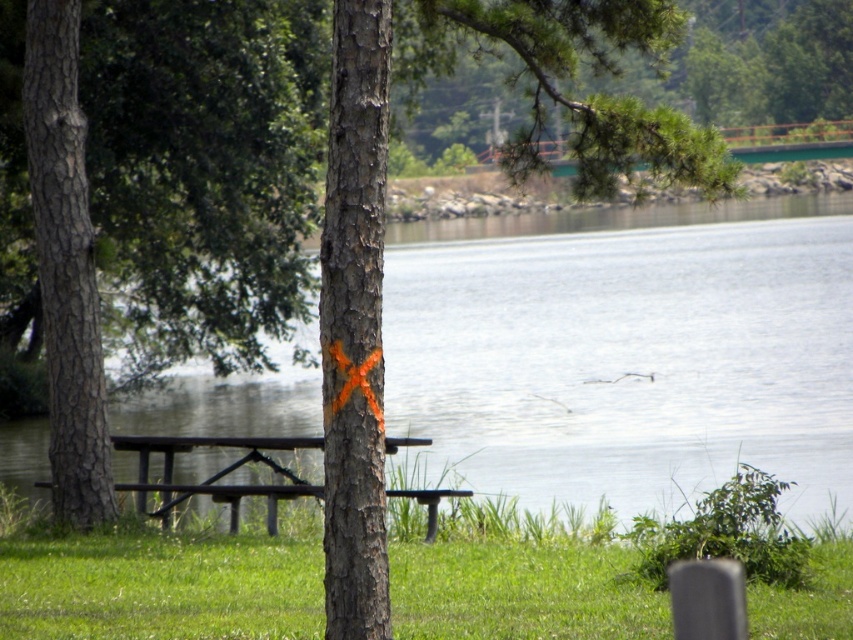
Who is positioned more to the right, transparent water at center or brown wooden picnic table at center?

transparent water at center is more to the right.

Who is more distant from viewer, (434, 259) or (259, 445)?

Positioned behind is point (434, 259).

Identify the location of transparent water at center. The image size is (853, 640). (628, 348).

Which is in front, point (457, 416) or point (181, 180)?

Positioned in front is point (181, 180).

Is point (170, 424) closer to camera compared to point (229, 179)?

No, it is behind (229, 179).

Which is behind, point (460, 220) or point (265, 273)?

The point (460, 220) is behind.

Where is `transparent water at center`? The image size is (853, 640). transparent water at center is located at coordinates (628, 348).

Is brown wooden picnic table at center thinner than wooden bench at center?

Yes, brown wooden picnic table at center is thinner than wooden bench at center.

Who is taller, brown wooden picnic table at center or wooden bench at center?

With more height is wooden bench at center.

Between point (137, 502) and point (36, 483), which one is positioned in front?

Point (36, 483) is more forward.

Locate an element on the screen. The width and height of the screenshot is (853, 640). brown wooden picnic table at center is located at coordinates (213, 445).